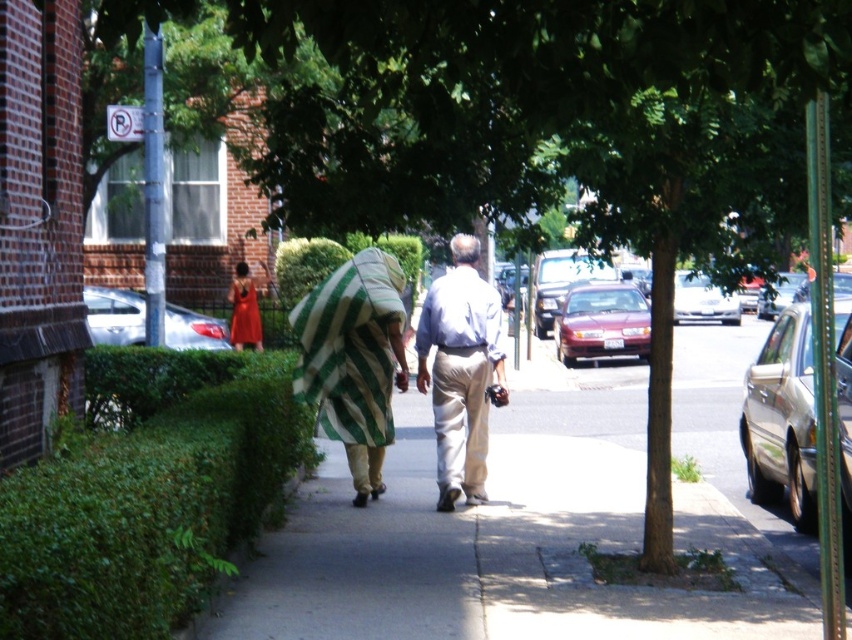
Question: Does green striped blanket at center appear over silver metallic sedan at center?

Choices:
 (A) no
 (B) yes

Answer: (A)

Question: Which point is closer to the camera taking this photo?

Choices:
 (A) (452, 468)
 (B) (611, 324)
 (C) (260, 346)
 (D) (787, 540)

Answer: (A)

Question: Does gold metallic sedan at right appear on the left side of silver metallic sedan at center?

Choices:
 (A) no
 (B) yes

Answer: (B)

Question: Estimate the real-world distances between objects in this image. Which object is farther from the silver metallic sedan at center?

Choices:
 (A) smooth concrete sidewalk at center
 (B) shiny maroon sedan at center
 (C) light blue shirt at center

Answer: (C)

Question: Does light blue shirt at center lie behind shiny orange dress at center?

Choices:
 (A) no
 (B) yes

Answer: (A)

Question: Which point is closer to the camera?

Choices:
 (A) green striped blanket at center
 (B) gold metallic sedan at right
 (C) light blue shirt at center

Answer: (B)